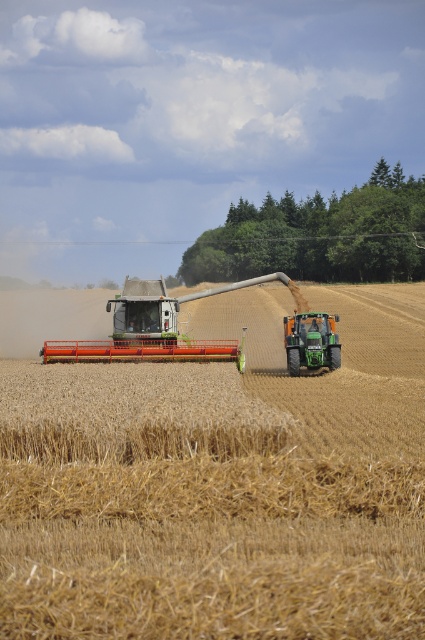
Which of these two, orange metallic plow at center or green matte tractor at center, stands shorter?

Standing shorter between the two is green matte tractor at center.

Is point (50, 358) closer to viewer compared to point (285, 339)?

Yes, it is in front of point (285, 339).

Identify the location of orange metallic plow at center. This screenshot has height=640, width=425. (158, 324).

Who is more distant from viewer, (297, 548) or (300, 348)?

Point (300, 348)

Is golden straw field at center above green matte tractor at center?

Incorrect, golden straw field at center is not positioned above green matte tractor at center.

You are a GUI agent. You are given a task and a screenshot of the screen. Output one action in this format:
    pyautogui.click(x=<x>, y=<y>)
    Task: Click on the golden straw field at center
    
    Given the screenshot: What is the action you would take?
    pyautogui.click(x=221, y=483)

Who is lower down, golden straw field at center or orange metallic plow at center?

Positioned lower is golden straw field at center.

How far apart are golden straw field at center and orange metallic plow at center?

golden straw field at center and orange metallic plow at center are 4.27 meters apart from each other.

Who is more distant from viewer, (390, 608) or (178, 346)?

Point (178, 346)

The height and width of the screenshot is (640, 425). What are the coordinates of `golden straw field at center` in the screenshot? It's located at (221, 483).